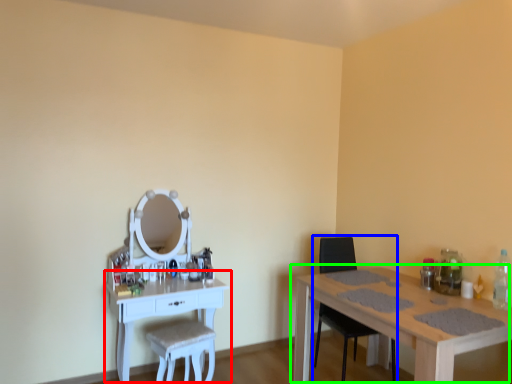
Question: Based on their relative distances, which object is nearer to table (highlighted by a red box)? Choose from chair (highlighted by a blue box) and table (highlighted by a green box).

Choices:
 (A) chair
 (B) table

Answer: (B)